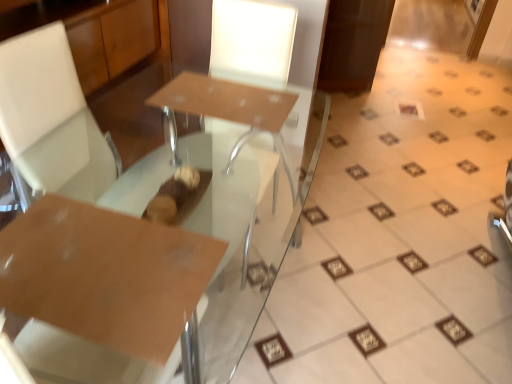
Question: Is matte brown table at center further to the viewer compared to glossy brown table at center?

Choices:
 (A) no
 (B) yes

Answer: (B)

Question: From the image's perspective, is matte brown table at center on top of glossy brown table at center?

Choices:
 (A) yes
 (B) no

Answer: (A)

Question: From a real-world perspective, is matte brown table at center physically below glossy brown table at center?

Choices:
 (A) yes
 (B) no

Answer: (A)

Question: Are matte brown table at center and glossy brown table at center located far from each other?

Choices:
 (A) yes
 (B) no

Answer: (B)

Question: Is the position of matte brown table at center less distant than that of glossy brown table at center?

Choices:
 (A) yes
 (B) no

Answer: (B)

Question: Considering the positions of point (143, 322) and point (417, 112), is point (143, 322) closer or farther from the camera than point (417, 112)?

Choices:
 (A) closer
 (B) farther

Answer: (A)

Question: From the image's perspective, is glossy brown table at center located above or below white glossy frame at upper right?

Choices:
 (A) above
 (B) below

Answer: (B)

Question: From a real-world perspective, relative to white glossy frame at upper right, is glossy brown table at center vertically above or below?

Choices:
 (A) below
 (B) above

Answer: (B)

Question: Considering the positions of glossy brown table at center and white glossy frame at upper right in the image, is glossy brown table at center wider or thinner than white glossy frame at upper right?

Choices:
 (A) thin
 (B) wide

Answer: (B)

Question: Based on their positions, is matte brown table at center located to the left or right of white glossy frame at upper right?

Choices:
 (A) left
 (B) right

Answer: (A)

Question: Which is correct: matte brown table at center is inside white glossy frame at upper right, or outside of it?

Choices:
 (A) outside
 (B) inside

Answer: (A)

Question: From a real-world perspective, is matte brown table at center positioned above or below white glossy frame at upper right?

Choices:
 (A) above
 (B) below

Answer: (A)

Question: Is matte brown table at center wider or thinner than white glossy frame at upper right?

Choices:
 (A) thin
 (B) wide

Answer: (B)

Question: From a real-world perspective, relative to glossy brown table at center, is white glossy frame at upper right vertically above or below?

Choices:
 (A) above
 (B) below

Answer: (B)

Question: From the image's perspective, is white glossy frame at upper right located above or below glossy brown table at center?

Choices:
 (A) below
 (B) above

Answer: (B)